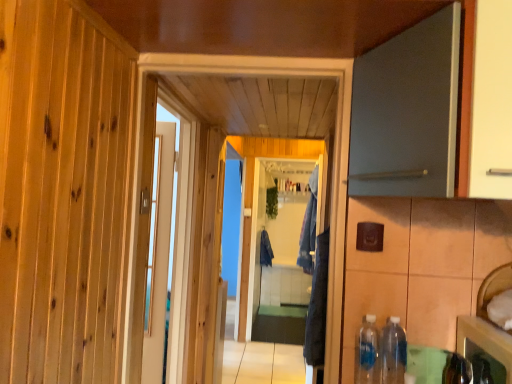
Question: Is clear glass screen door at center thinner than white glossy door at center, the first door viewed from the back?

Choices:
 (A) no
 (B) yes

Answer: (B)

Question: Is clear glass screen door at center positioned with its back to white glossy door at center, the first door viewed from the back?

Choices:
 (A) yes
 (B) no

Answer: (B)

Question: Is clear glass screen door at center at the right side of white glossy door at center, which is counted as the 2th door, starting from the front?

Choices:
 (A) yes
 (B) no

Answer: (A)

Question: From the image's perspective, is clear glass screen door at center beneath white glossy door at center, the second door when ordered from right to left?

Choices:
 (A) yes
 (B) no

Answer: (A)

Question: From a real-world perspective, is clear glass screen door at center located higher than white glossy door at center, the second door when ordered from right to left?

Choices:
 (A) yes
 (B) no

Answer: (B)

Question: Would you say clear glass screen door at center is outside white glossy door at center, which is counted as the first door, starting from the left?

Choices:
 (A) no
 (B) yes

Answer: (B)

Question: Does matte gray door at upper right, placed as the 1th door when sorted from front to back, appear on the left side of dark blue fabric at center, which ranks as the second laundry in right-to-left order?

Choices:
 (A) yes
 (B) no

Answer: (B)

Question: Can you confirm if matte gray door at upper right, placed as the 1th door when sorted from front to back, is bigger than dark blue fabric at center, the 1th laundry from the left?

Choices:
 (A) no
 (B) yes

Answer: (B)

Question: Is matte gray door at upper right, positioned as the 2th door in back-to-front order, to the right of dark blue fabric at center, which ranks as the second laundry in right-to-left order, from the viewer's perspective?

Choices:
 (A) yes
 (B) no

Answer: (A)

Question: Is matte gray door at upper right, placed as the first door when sorted from right to left, wider than dark blue fabric at center, which ranks as the second laundry in right-to-left order?

Choices:
 (A) yes
 (B) no

Answer: (A)

Question: Is matte gray door at upper right, placed as the first door when sorted from right to left, turned away from dark blue fabric at center, which ranks as the second laundry in right-to-left order?

Choices:
 (A) no
 (B) yes

Answer: (B)

Question: Is matte gray door at upper right, placed as the 1th door when sorted from front to back, placed right next to dark blue fabric at center, which ranks as the second laundry in right-to-left order?

Choices:
 (A) no
 (B) yes

Answer: (A)

Question: Is shiny metallic cabinet at lower right shorter than clear plastic bottle at lower right, which is the 1th bottle from right to left?

Choices:
 (A) no
 (B) yes

Answer: (B)